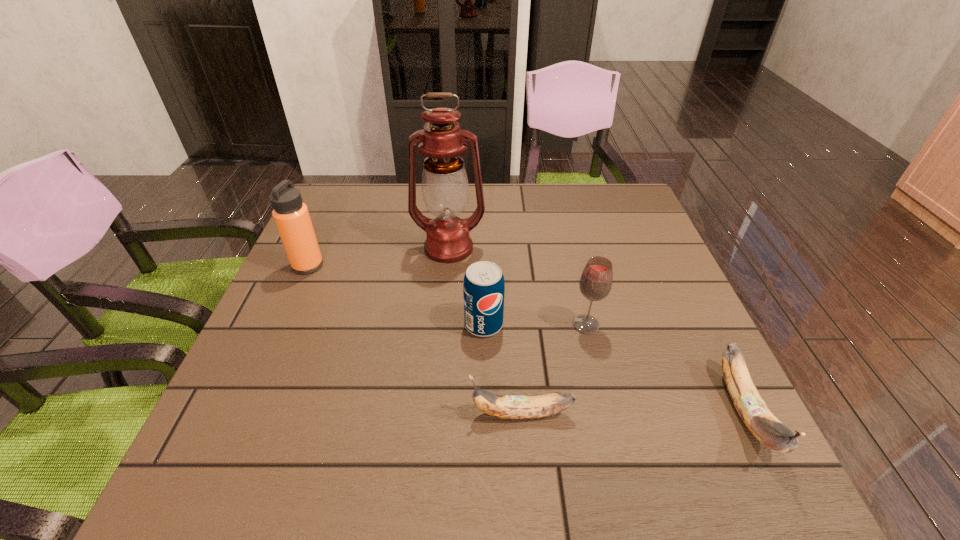
Find the location of a particular element. The height and width of the screenshot is (540, 960). vacant space at the near edge of the desktop is located at coordinates (624, 404).

Identify the location of free space at the left edge of the desktop. The image size is (960, 540). (322, 329).

Find the location of a particular element. The image size is (960, 540). vacant space at the right edge of the desktop is located at coordinates (660, 275).

This screenshot has height=540, width=960. Identify the location of vacant space at the far left corner. (332, 191).

The height and width of the screenshot is (540, 960). In order to click on vacant space at the near left corner in this screenshot , I will do `click(302, 402)`.

The height and width of the screenshot is (540, 960). In the image, there is a desktop. In order to click on vacant space at the far right corner in this screenshot , I will do `click(621, 185)`.

This screenshot has width=960, height=540. What are the coordinates of `empty space between the glass drink container and the leftmost object` in the screenshot? It's located at (447, 295).

At what (x,y) coordinates should I click in order to perform the action: click on free space between the glass drink container and the leftmost object. Please return your answer as a coordinate pair (x, y). This screenshot has height=540, width=960. Looking at the image, I should click on (447, 295).

Where is `vacant space that is in between the shortest object and the pop`? The image size is (960, 540). vacant space that is in between the shortest object and the pop is located at coordinates (502, 369).

Where is `vacant area that lies between the leftmost object and the second shortest object`? vacant area that lies between the leftmost object and the second shortest object is located at coordinates (526, 339).